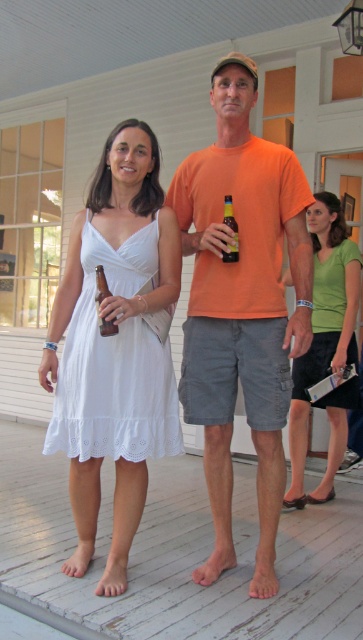
You are standing on the wooden deck and want to place a small potted plant between the two points marked as point (x=124, y=355) and point (x=333, y=316). Which point should the plant be closer to in order to be nearer to the viewer?

The plant should be closer to point (x=124, y=355) because it is closer to the viewer than point (x=333, y=316).

You are a fashion designer observing two dresses in the scene. The white lace dress at center and the black textured fabric dress at lower right. Which dress is positioned lower in the image?

The white lace dress at center is positioned lower than the black textured fabric dress at lower right according to the description.